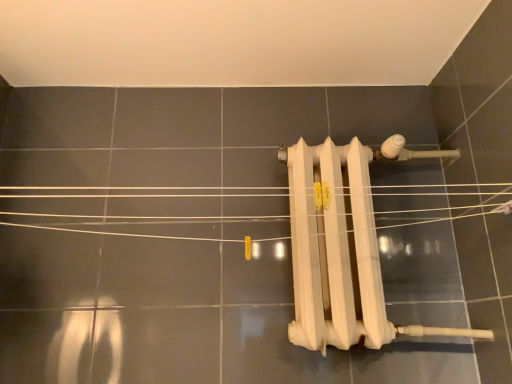
Measure the distance between point (367, 223) and camera.

They are 3.76 feet apart.

What is the approximate width of white matte radiator at center?

It is 8.81 inches.

What do you see at coordinates (343, 247) in the screenshot? I see `white matte radiator at center` at bounding box center [343, 247].

The height and width of the screenshot is (384, 512). Identify the location of white matte radiator at center. [x=343, y=247].

The width and height of the screenshot is (512, 384). In order to click on white matte radiator at center in this screenshot , I will do `click(343, 247)`.